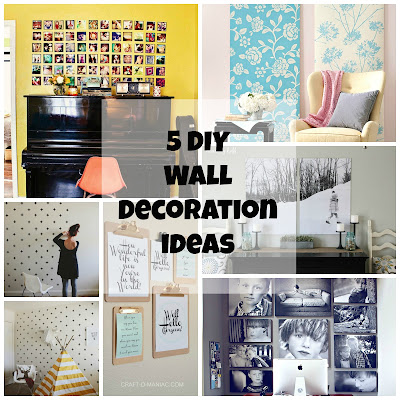
The image size is (400, 400). In order to click on teepee for kids - yellow and white stripped in this screenshot , I will do `click(63, 373)`.